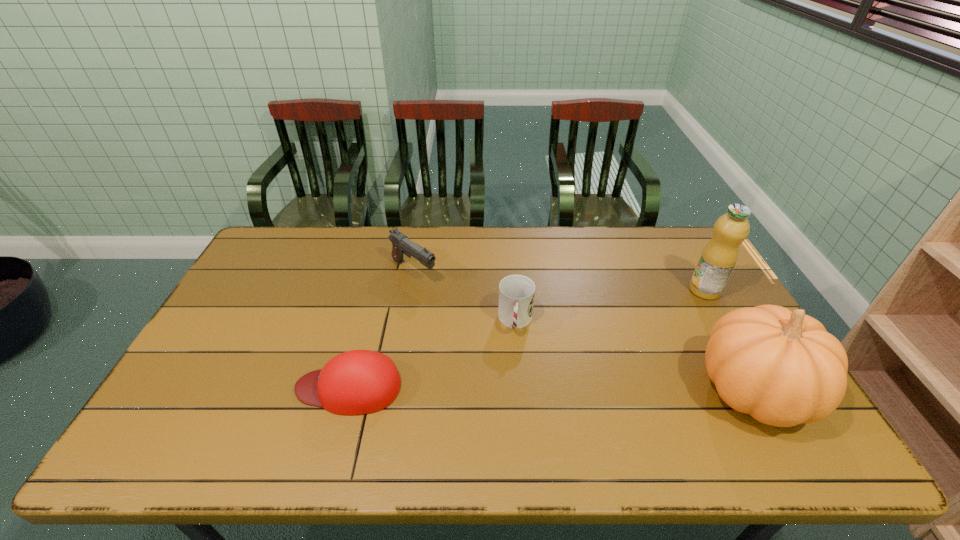
Image resolution: width=960 pixels, height=540 pixels. I want to click on baseball cap, so click(x=356, y=382).

Where is `pumpkin`? pumpkin is located at coordinates (782, 367).

In order to click on the third object from right to left in this screenshot , I will do pyautogui.click(x=516, y=292).

Locate an element on the screen. cup is located at coordinates (516, 292).

Where is `fruit juice`? The width and height of the screenshot is (960, 540). fruit juice is located at coordinates (718, 259).

Image resolution: width=960 pixels, height=540 pixels. I want to click on gun, so click(401, 245).

Find the location of `vacant area situated 0.260m on the front-facing side of the baseball cap`. vacant area situated 0.260m on the front-facing side of the baseball cap is located at coordinates 196,387.

Identify the location of free space located on the front-facing side of the baseball cap. (200, 387).

You are a GUI agent. You are given a task and a screenshot of the screen. Output one action in this format:
    pyautogui.click(x=<x>, y=<y>)
    Task: Click on the blank area located on the front-facing side of the baseball cap
    This screenshot has width=960, height=540.
    Given the screenshot: What is the action you would take?
    pyautogui.click(x=173, y=387)

Find the location of `free location located 0.370m on the back of the pumpkin`. free location located 0.370m on the back of the pumpkin is located at coordinates (684, 262).